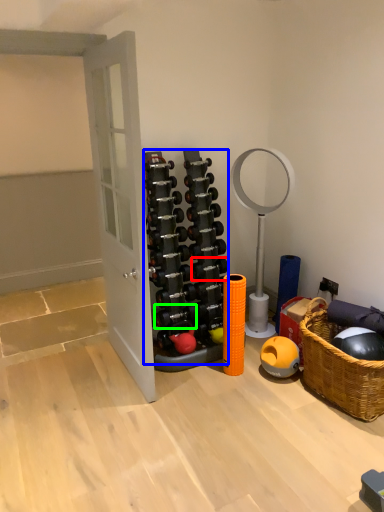
Question: Estimate the real-world distances between objects in this image. Which object is closer to dumbbell (highlighted by a red box), dumbbell (highlighted by a blue box) or dumbbell (highlighted by a green box)?

Choices:
 (A) dumbbell
 (B) dumbbell

Answer: (A)